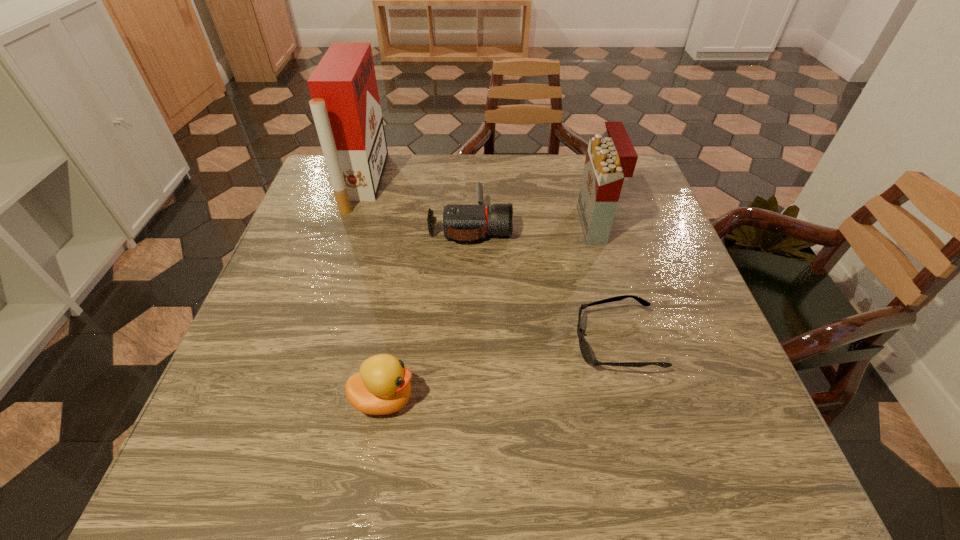
In order to click on blank region between the second nearest object and the right cigarette case in this screenshot , I will do `click(605, 284)`.

You are a GUI agent. You are given a task and a screenshot of the screen. Output one action in this format:
    pyautogui.click(x=<x>, y=<y>)
    Task: Click on the free space between the sunglasses and the leftmost object
    Image resolution: width=960 pixels, height=540 pixels.
    Given the screenshot: What is the action you would take?
    pyautogui.click(x=490, y=262)

The image size is (960, 540). I want to click on vacant area that lies between the leftmost object and the duckling, so click(373, 291).

Locate an element on the screen. This screenshot has height=540, width=960. empty space between the fourth shortest object and the nearest object is located at coordinates (489, 312).

Where is `vacant space that is in between the shortest object and the third shortest object`? The height and width of the screenshot is (540, 960). vacant space that is in between the shortest object and the third shortest object is located at coordinates (499, 371).

Identify the location of vacant space that is in between the taller cigarette case and the sunglasses. (490, 262).

The width and height of the screenshot is (960, 540). Find the location of `free space that is in between the duckling and the second shortest object`. free space that is in between the duckling and the second shortest object is located at coordinates click(427, 312).

You are a GUI agent. You are given a task and a screenshot of the screen. Output one action in this format:
    pyautogui.click(x=<x>, y=<y>)
    Task: Click on the free point between the sunglasses and the fourth shortest object
    
    Given the screenshot: What is the action you would take?
    pyautogui.click(x=605, y=284)

Identify which object is the third closest to the nearest object. Please provide its 2D coordinates. Your answer should be formatted as a tuple, i.e. [(x, y)], where the tuple contains the x and y coordinates of a point satisfying the conditions above.

[(345, 104)]

Point out which object is positioned as the third nearest to the camcorder. Please provide its 2D coordinates. Your answer should be formatted as a tuple, i.e. [(x, y)], where the tuple contains the x and y coordinates of a point satisfying the conditions above.

[(584, 348)]